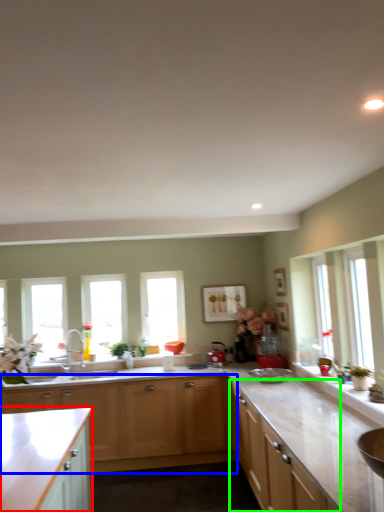
Question: Which object is positioned closest to cabinetry (highlighted by a red box)? Select from cabinetry (highlighted by a blue box) and cabinetry (highlighted by a green box).

Choices:
 (A) cabinetry
 (B) cabinetry

Answer: (A)